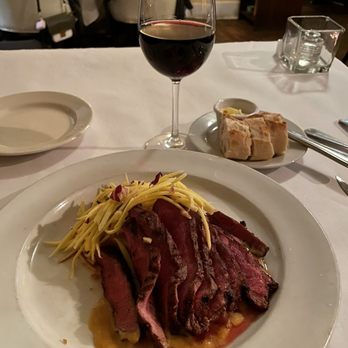
Locate an element on the screen. Image resolution: width=348 pixels, height=348 pixels. small plate is located at coordinates (46, 127).